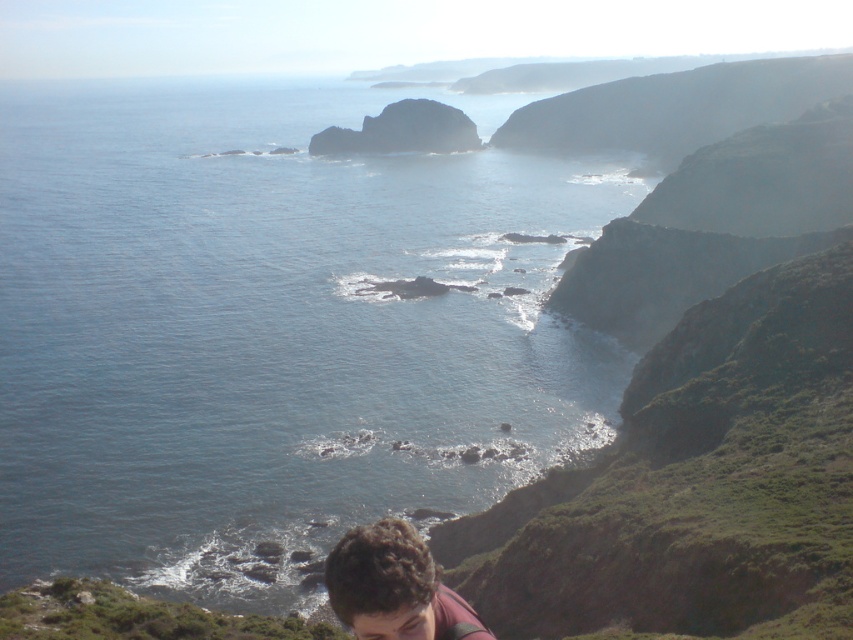
Measure the distance between point (16,444) and camera.

They are 277.87 feet apart.

Is point (428, 157) positioned in front of point (422, 576)?

No.

Which is in front, point (248, 483) or point (398, 538)?

Positioned in front is point (398, 538).

Locate an element on the screen. The width and height of the screenshot is (853, 640). blue water at center is located at coordinates (271, 330).